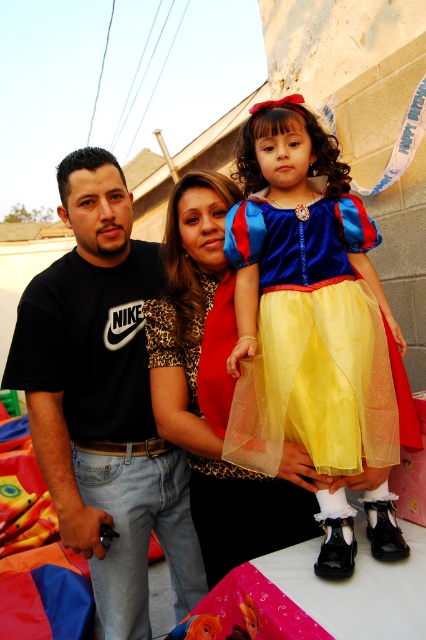
You are a photographer at the birthday party and need to position two guests wearing the velvet yellow dress at center and the velvet leopard print dress at center so that they can both fit in the frame without overlapping. What is the minimum distance you should keep between them?

The velvet yellow dress at center and the velvet leopard print dress at center are 38.56 centimeters apart, so the photographer should keep them at least 38.56 centimeters apart to ensure they both fit in the frame without overlapping.